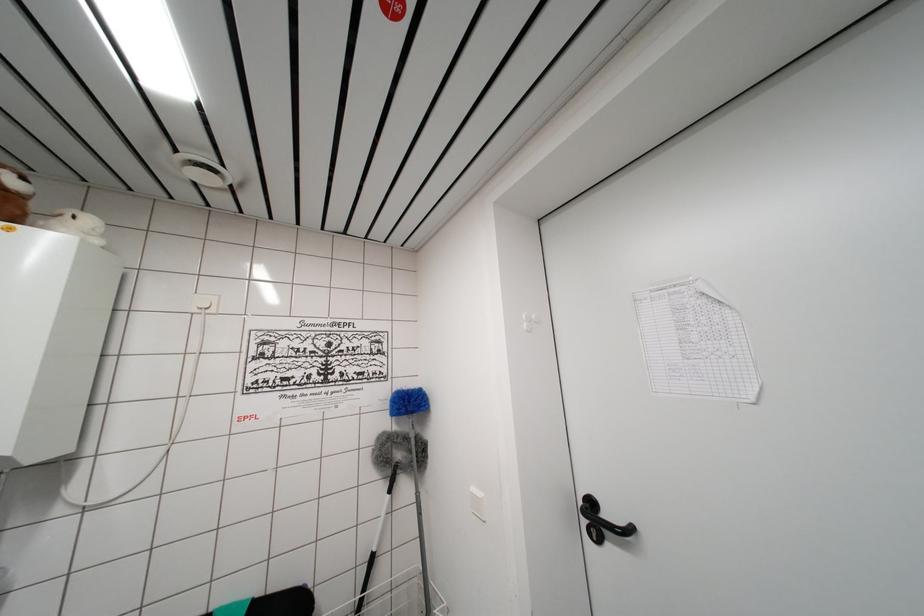
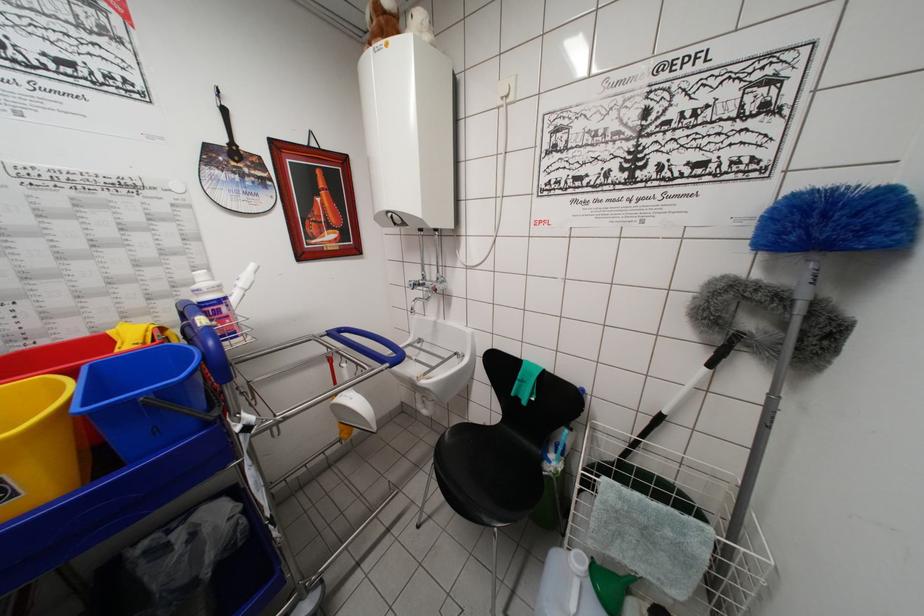
In the second image, find the point that corresponds to the point at 371,564 in the first image.

(658, 419)